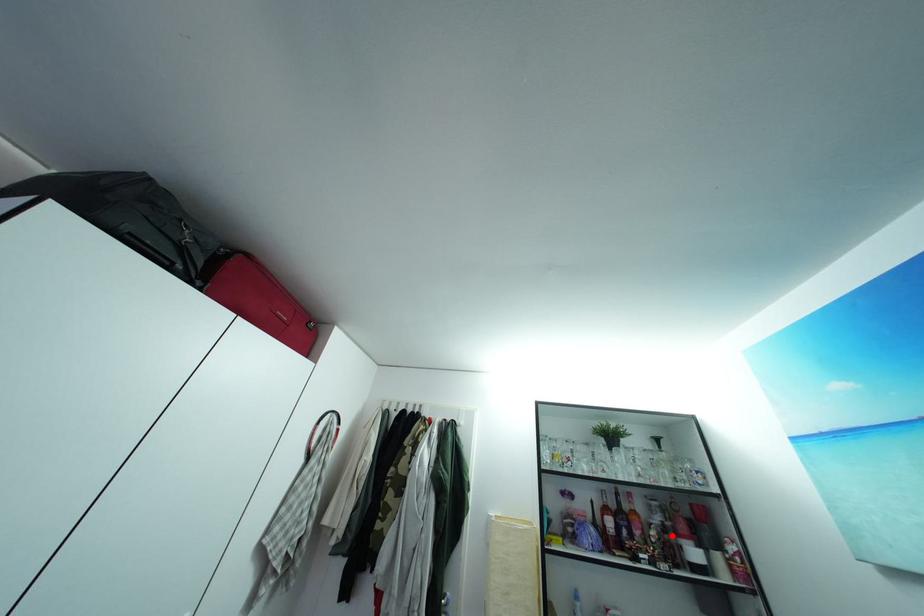
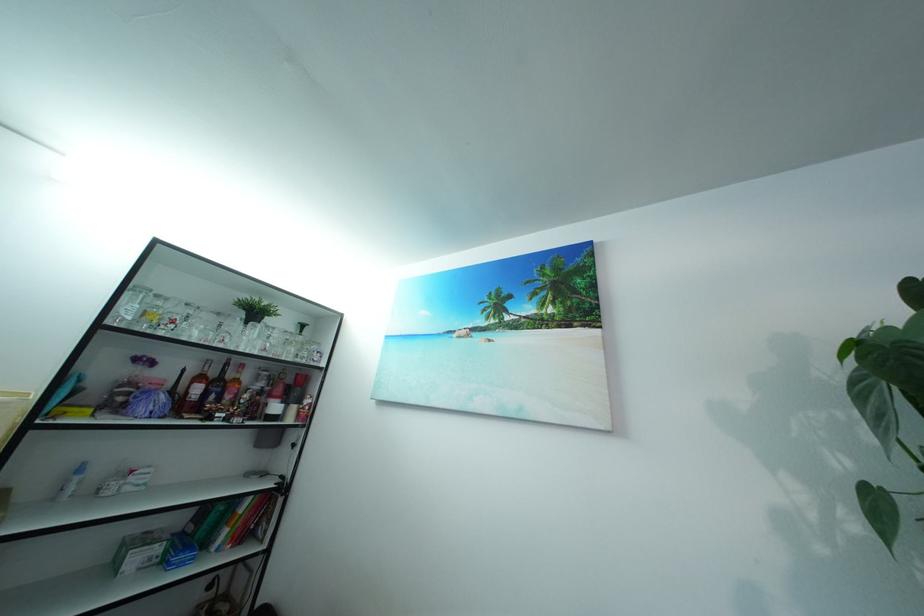
In the second image, find the point that corresponds to the highlighted location in the first image.

(269, 400)